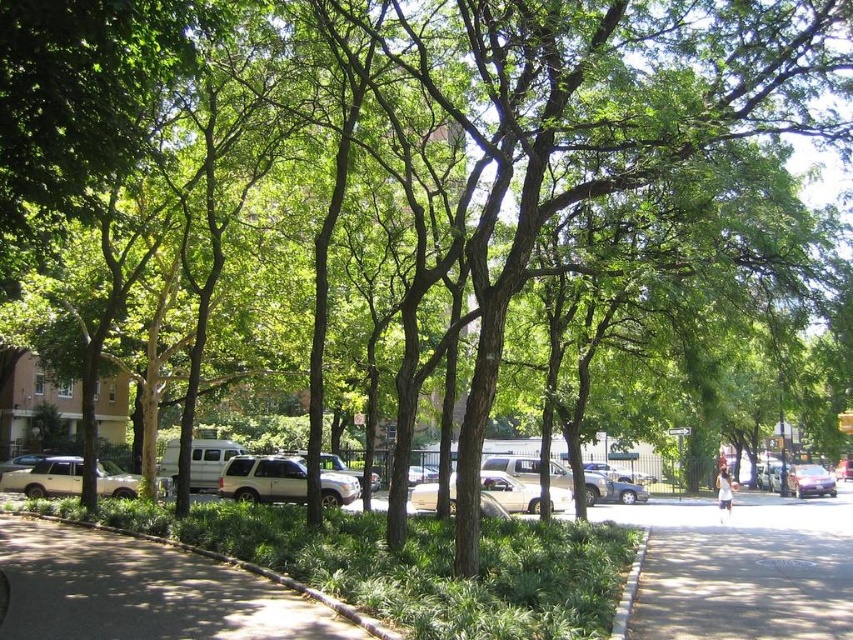
Question: From the image, what is the correct spatial relationship of matte silver suv at lower left in relation to metallic silver car at center?

Choices:
 (A) right
 (B) left

Answer: (B)

Question: Which of the following is the closest to the observer?

Choices:
 (A) metallic silver car at center
 (B) green grass at lower left
 (C) silver metallic suv at center
 (D) matte silver suv at lower left

Answer: (B)

Question: Among these objects, which one is farthest from the camera?

Choices:
 (A) gray concrete curb at lower right
 (B) metallic silver car at center
 (C) silver metallic suv at center
 (D) matte silver suv at lower left

Answer: (B)

Question: Does green grass at lower left appear on the left side of gray concrete curb at lower right?

Choices:
 (A) yes
 (B) no

Answer: (A)

Question: Observing the image, what is the correct spatial positioning of metallic silver car at center in reference to gray concrete curb at lower right?

Choices:
 (A) above
 (B) below

Answer: (B)

Question: Estimate the real-world distances between objects in this image. Which object is farther from the silver metallic suv at center?

Choices:
 (A) purple glossy sedan at center-right
 (B) matte silver suv at lower left
 (C) green grass at lower left
 (D) metallic silver car at center

Answer: (A)